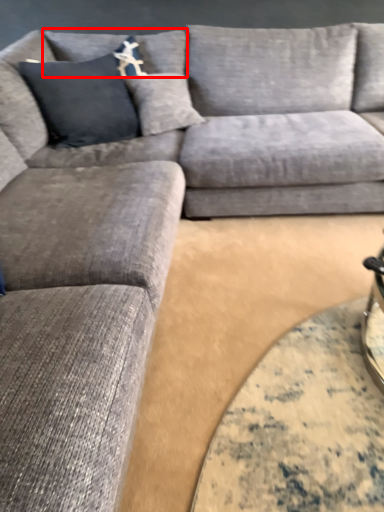
Question: From the image's perspective, where is pillow (annotated by the red box) located in relation to couch in the image?

Choices:
 (A) above
 (B) below

Answer: (A)